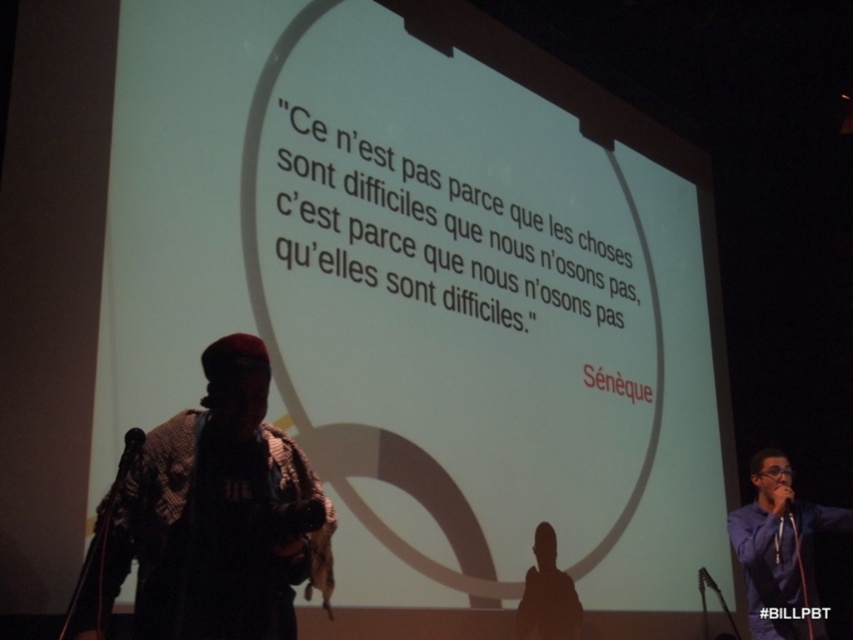
You are organizing a small event and need to place a 12 inch wide decorative stand between the purple shirt at lower right and the black matte microphone at lower left. Can the stand fit between them based on their widths?

The purple shirt at lower right is wider than the black matte microphone at lower left. Since the stand is 12 inches wide, it depends on the actual widths of the objects. However, without specific measurements, we cannot confirm if there is enough space.

You are an event organizer who needs to ensure that the purple shirt at lower right and the black matte microphone at lower left are visible to the audience. Considering their sizes, which object might require additional lighting to ensure visibility?

The purple shirt at lower right is bigger than the black matte microphone at lower left, so the black matte microphone at lower left might need additional lighting to ensure visibility since it is smaller and could be less noticeable from a distance.

You are an event organizer who needs to adjust the height of the purple shirt at lower right and the black matte microphone at lower left to ensure they are at the same level for a live broadcast. What adjustment should you make?

The purple shirt at lower right is much taller than the black matte microphone at lower left, so you should lower the purple shirt at lower right or raise the black matte microphone at lower left to make them level.